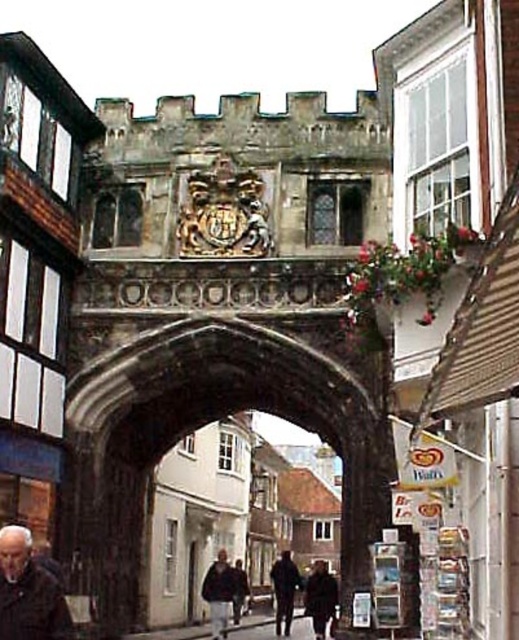
Question: Which of these objects is positioned farthest from the dark brown leather coat at center?

Choices:
 (A) dark brown leather jacket at center
 (B) dark brown coat at center
 (C) dark brown leather jacket at lower left
 (D) stone archway at center

Answer: (C)

Question: Does stone archway at center appear on the left side of dark brown leather coat at center?

Choices:
 (A) no
 (B) yes

Answer: (B)

Question: Which of the following is the closest to the observer?

Choices:
 (A) (214, 595)
 (B) (45, 618)
 (C) (299, 579)
 (D) (321, 604)

Answer: (B)

Question: Can you confirm if stone archway at center is smaller than dark brown leather coat at center?

Choices:
 (A) no
 (B) yes

Answer: (A)

Question: Is dark brown leather jacket at center smaller than dark brown leather coat at center?

Choices:
 (A) no
 (B) yes

Answer: (B)

Question: Among these points, which one is farthest from the camera?

Choices:
 (A) (216, 637)
 (B) (282, 611)

Answer: (B)